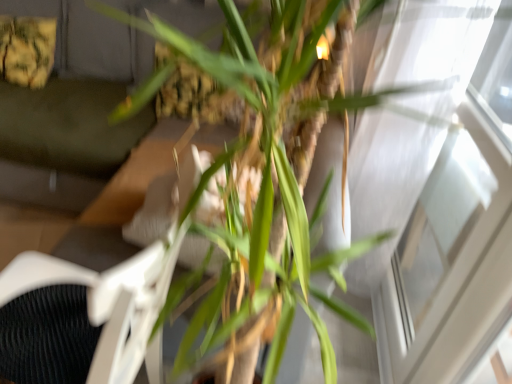
Question: Is white textured swivel chair at center next to green leafy plant at center and touching it?

Choices:
 (A) no
 (B) yes

Answer: (A)

Question: Does white textured swivel chair at center have a greater height compared to green leafy plant at center?

Choices:
 (A) yes
 (B) no

Answer: (B)

Question: Is white textured swivel chair at center looking in the opposite direction of green leafy plant at center?

Choices:
 (A) yes
 (B) no

Answer: (A)

Question: Does white textured swivel chair at center lie behind green leafy plant at center?

Choices:
 (A) yes
 (B) no

Answer: (A)

Question: Is white textured swivel chair at center far away from green leafy plant at center?

Choices:
 (A) yes
 (B) no

Answer: (B)

Question: Is transparent glass window at upper right inside the boundaries of white textured swivel chair at center, or outside?

Choices:
 (A) outside
 (B) inside

Answer: (A)

Question: From the image's perspective, is transparent glass window at upper right located above or below white textured swivel chair at center?

Choices:
 (A) above
 (B) below

Answer: (A)

Question: Considering the positions of point (467, 253) and point (150, 367), is point (467, 253) closer or farther from the camera than point (150, 367)?

Choices:
 (A) farther
 (B) closer

Answer: (B)

Question: From a real-world perspective, relative to white textured swivel chair at center, is transparent glass window at upper right vertically above or below?

Choices:
 (A) above
 (B) below

Answer: (A)

Question: Considering the positions of transparent glass window at upper right and green leafy plant at center in the image, is transparent glass window at upper right wider or thinner than green leafy plant at center?

Choices:
 (A) thin
 (B) wide

Answer: (A)

Question: Considering the positions of transparent glass window at upper right and green leafy plant at center in the image, is transparent glass window at upper right taller or shorter than green leafy plant at center?

Choices:
 (A) short
 (B) tall

Answer: (A)

Question: Considering their positions, is transparent glass window at upper right located in front of or behind green leafy plant at center?

Choices:
 (A) front
 (B) behind

Answer: (B)

Question: Is transparent glass window at upper right situated inside green leafy plant at center or outside?

Choices:
 (A) inside
 (B) outside

Answer: (B)

Question: Considering their positions, is dark gray fabric couch at upper left located in front of or behind transparent glass window at upper right?

Choices:
 (A) front
 (B) behind

Answer: (B)

Question: Is point (62, 34) positioned closer to the camera than point (504, 317)?

Choices:
 (A) closer
 (B) farther

Answer: (B)